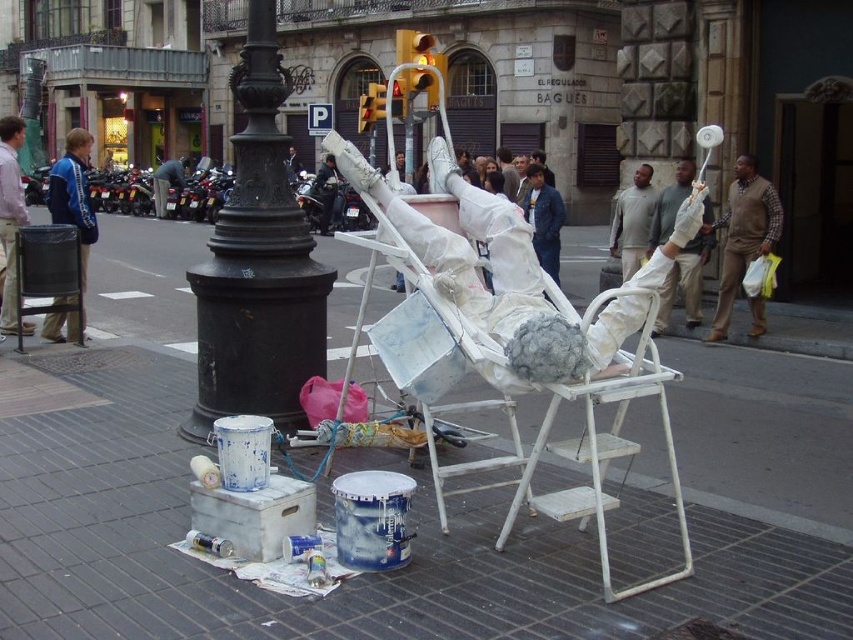
Question: Which object is the farthest from the white fabric figure at center?

Choices:
 (A) brown plaid shirt at right
 (B) black cast iron pole at center

Answer: (A)

Question: Observing the image, what is the correct spatial positioning of black cast iron pole at center in reference to white fabric figure at center?

Choices:
 (A) left
 (B) right

Answer: (A)

Question: Can you confirm if white fabric figure at center is thinner than brushed metal jacket at upper left?

Choices:
 (A) yes
 (B) no

Answer: (B)

Question: Which is farther from the white painted pavement at center?

Choices:
 (A) brushed metal jacket at upper left
 (B) brown plaid shirt at right
 (C) black cast iron pole at center

Answer: (A)

Question: Among these objects, which one is farthest from the camera?

Choices:
 (A) black cast iron pole at center
 (B) brushed metal jacket at upper left
 (C) brown plaid shirt at right

Answer: (C)

Question: Is black cast iron pole at center positioned at the back of brown plaid shirt at right?

Choices:
 (A) no
 (B) yes

Answer: (A)